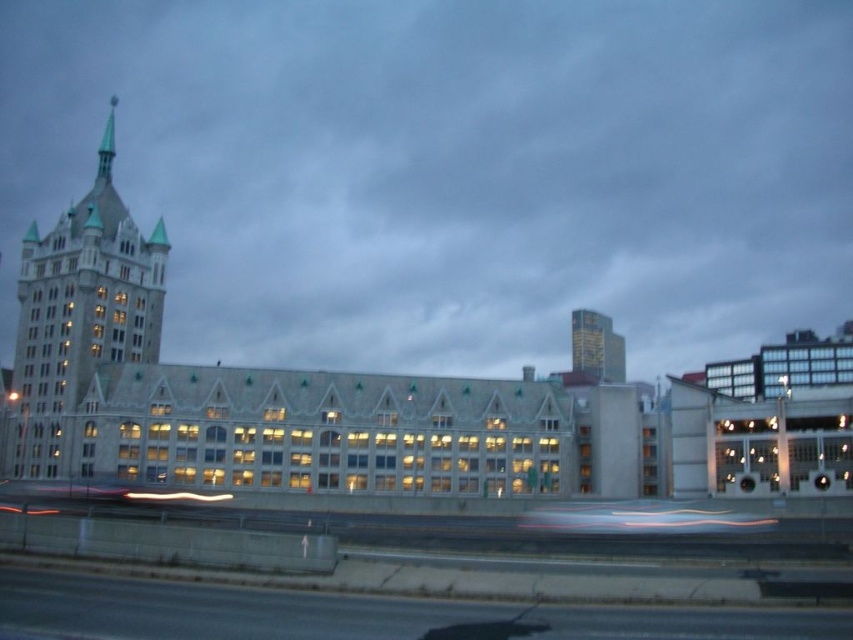
Question: Is black asphalt highway at lower left thinner than matte stone tower at upper left?

Choices:
 (A) no
 (B) yes

Answer: (A)

Question: Which point is closer to the camera?

Choices:
 (A) (572, 349)
 (B) (107, 580)
 (C) (103, 164)

Answer: (B)

Question: Is black asphalt highway at lower left to the left of gold metallic building at upper right from the viewer's perspective?

Choices:
 (A) no
 (B) yes

Answer: (B)

Question: Estimate the real-world distances between objects in this image. Which object is farther from the black asphalt highway at lower left?

Choices:
 (A) matte stone tower at upper left
 (B) gold metallic building at upper right

Answer: (B)

Question: Estimate the real-world distances between objects in this image. Which object is closer to the gold metallic building at upper right?

Choices:
 (A) black asphalt highway at lower left
 (B) matte stone tower at upper left

Answer: (B)

Question: In this image, where is matte stone tower at upper left located relative to gold metallic building at upper right?

Choices:
 (A) above
 (B) below

Answer: (A)